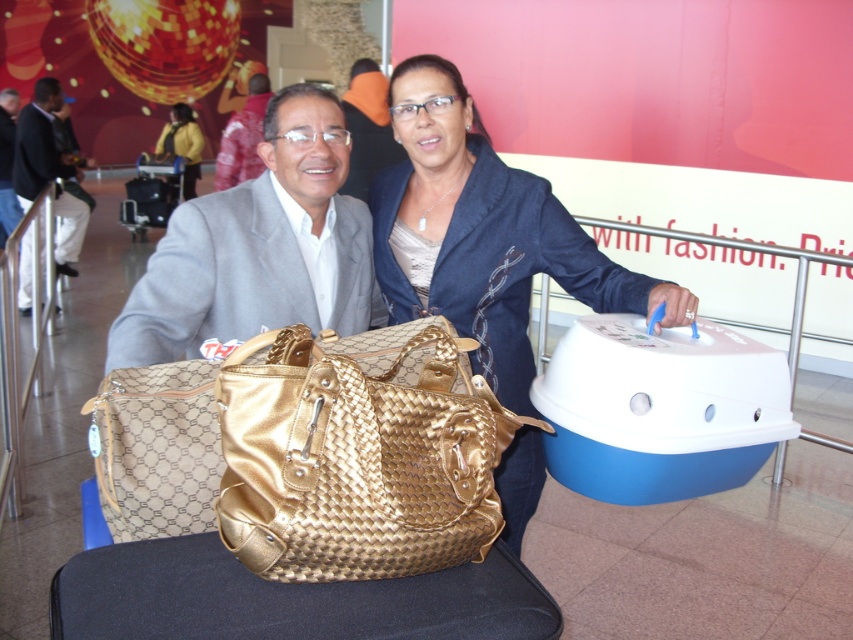
Does metallic gold handbag at center have a larger size compared to yellow fabric jacket at upper left?

Indeed, metallic gold handbag at center has a larger size compared to yellow fabric jacket at upper left.

Is metallic gold handbag at center positioned behind yellow fabric jacket at upper left?

That is False.

Where is `metallic gold handbag at center`? The height and width of the screenshot is (640, 853). metallic gold handbag at center is located at coordinates (242, 136).

Which is behind, point (404, 440) or point (161, 140)?

Positioned behind is point (161, 140).

This screenshot has width=853, height=640. I want to click on gold metallic handbag at center, so click(x=358, y=460).

Does matte gold handbag at lower center have a smaller size compared to metallic gold handbag at center?

A: Yes, matte gold handbag at lower center is smaller than metallic gold handbag at center.

Where is `matte gold handbag at lower center`? Image resolution: width=853 pixels, height=640 pixels. matte gold handbag at lower center is located at coordinates (258, 248).

In order to click on matte gold handbag at lower center in this screenshot , I will do `click(258, 248)`.

Where is `matte gold handbag at lower center`? matte gold handbag at lower center is located at coordinates pos(258,248).